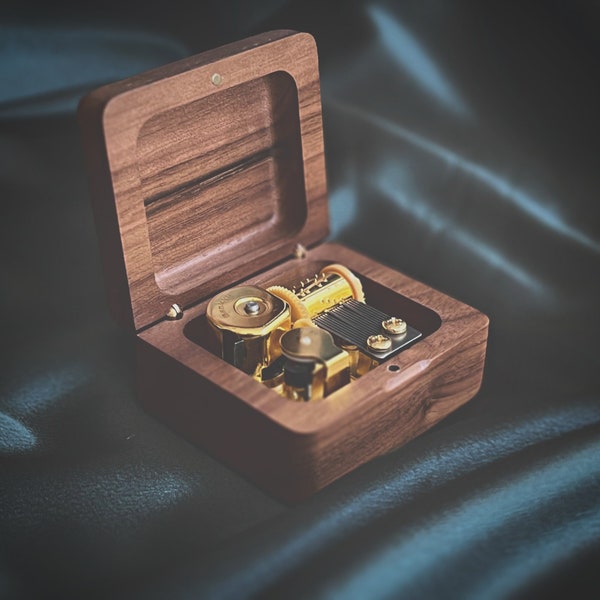
In order to click on wooden  box in this screenshot , I will do `click(413, 401)`.